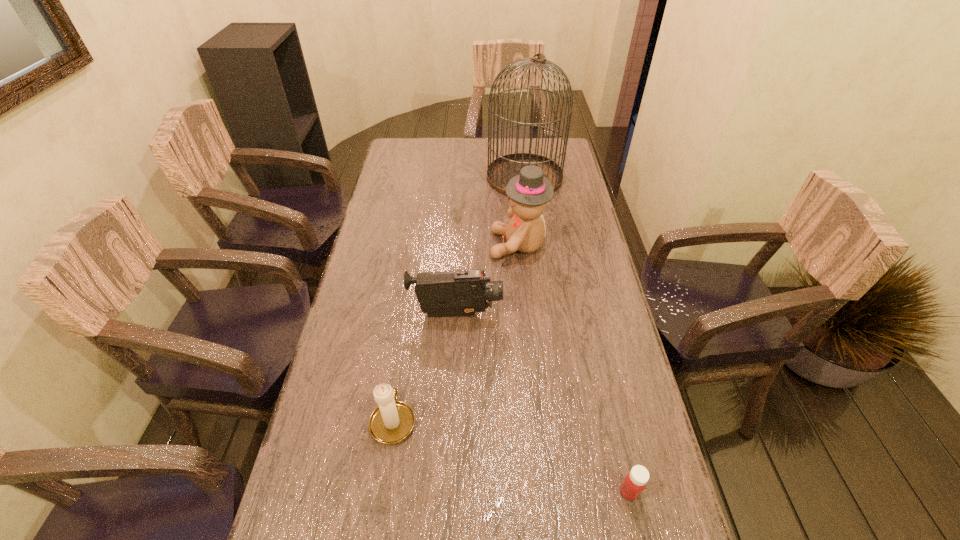
This screenshot has width=960, height=540. Find the location of `blank space located on the front-facing side of the second farthest object`. blank space located on the front-facing side of the second farthest object is located at coordinates (420, 245).

Where is `vacant space positioned 0.230m on the front-facing side of the second farthest object`? This screenshot has height=540, width=960. vacant space positioned 0.230m on the front-facing side of the second farthest object is located at coordinates (420, 245).

Identify the location of free spot located on the front-facing side of the third nearest object. The image size is (960, 540). (594, 314).

Identify the location of vacant space located on the handle side of the candle holder. (410, 306).

You are a GUI agent. You are given a task and a screenshot of the screen. Output one action in this format:
    pyautogui.click(x=<x>, y=<y>)
    Task: Click on the vacant position located on the handle side of the candle holder
    Image resolution: width=960 pixels, height=540 pixels.
    Given the screenshot: What is the action you would take?
    pyautogui.click(x=410, y=309)

Identify the location of vacant space located on the handle side of the candle holder. This screenshot has width=960, height=540. (414, 281).

Identify the location of vacant position located on the back of the shortest object. This screenshot has width=960, height=540. (602, 372).

Where is `object at the far edge`? The height and width of the screenshot is (540, 960). object at the far edge is located at coordinates (500, 171).

This screenshot has height=540, width=960. I want to click on object at the left edge, so click(392, 421).

Find the location of `birdcage at the right edge`. birdcage at the right edge is located at coordinates (500, 171).